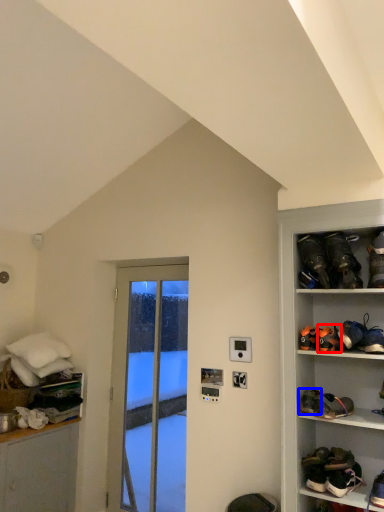
Question: Which object appears closest to the camera in this image, footwear (highlighted by a red box) or footwear (highlighted by a blue box)?

Choices:
 (A) footwear
 (B) footwear

Answer: (B)